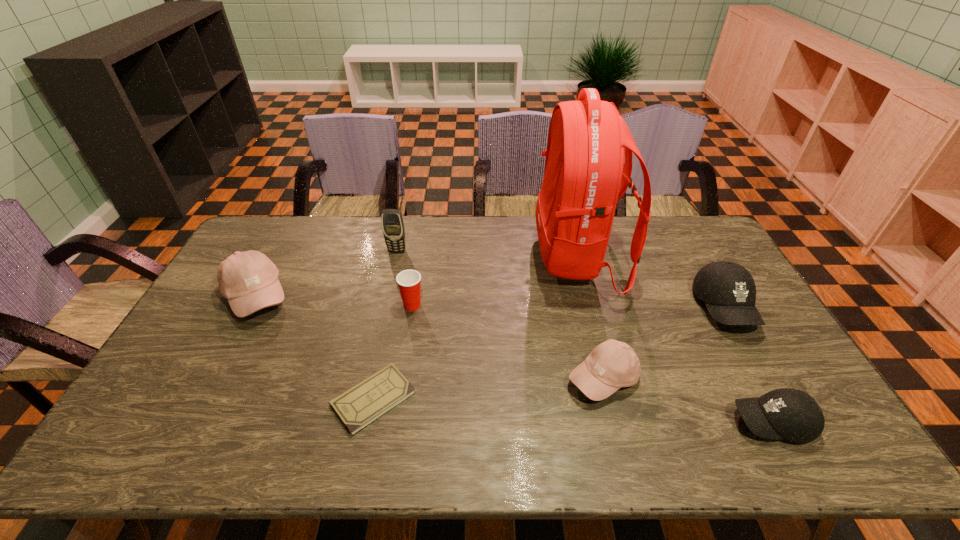
This screenshot has height=540, width=960. Find the location of `vacant region between the Dixie cup and the farther black baseball cap`. vacant region between the Dixie cup and the farther black baseball cap is located at coordinates (568, 306).

Where is `free space between the red backpack and the shortest object`? Image resolution: width=960 pixels, height=540 pixels. free space between the red backpack and the shortest object is located at coordinates pyautogui.click(x=475, y=328).

Where is `the second closest object to the leftmost baseball cap`? Image resolution: width=960 pixels, height=540 pixels. the second closest object to the leftmost baseball cap is located at coordinates (392, 222).

Identify the location of object that is the fourth nearest to the left pink baseball cap. The image size is (960, 540). (585, 175).

The image size is (960, 540). Find the location of `baseball cap object that ranks as the closest to the leftmost object`. baseball cap object that ranks as the closest to the leftmost object is located at coordinates (611, 365).

You are a GUI agent. You are given a task and a screenshot of the screen. Output one action in this format:
    pyautogui.click(x=<x>, y=<y>)
    Task: Click on the baseball cap that stands as the third closest to the backpack
    
    Given the screenshot: What is the action you would take?
    pyautogui.click(x=791, y=414)

Locate an element on the screen. vacant area that satisfies the following two spatial constraints: 1. on the front-facing side of the leftmost baseball cap; 2. on the right side of the checkbook is located at coordinates (202, 399).

Identify the location of vacant space that satisfies the following two spatial constraints: 1. on the front face of the cellular telephone; 2. on the right side of the checkbook. This screenshot has height=540, width=960. (364, 399).

Where is `blank space that satisfies the following two spatial constraints: 1. on the front-facing side of the Dixie cup; 2. on the left side of the leftmost object`? blank space that satisfies the following two spatial constraints: 1. on the front-facing side of the Dixie cup; 2. on the left side of the leftmost object is located at coordinates (252, 305).